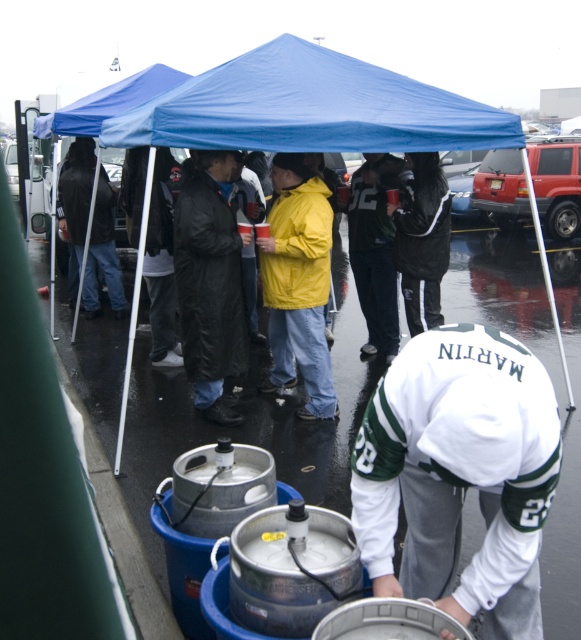
Question: Observing the image, what is the correct spatial positioning of matte black jacket at center in reference to dark blue jacket at center?

Choices:
 (A) right
 (B) left

Answer: (A)

Question: Based on their relative distances, which object is farther from the yellow matte jacket at center?

Choices:
 (A) blue fabric canopy at upper center
 (B) white jersey at lower center

Answer: (B)

Question: Considering the relative positions of black leather coat at center and dark blue jacket at center in the image provided, where is black leather coat at center located with respect to dark blue jacket at center?

Choices:
 (A) below
 (B) above

Answer: (A)

Question: Which object is the farthest from the white jersey at lower center?

Choices:
 (A) matte black jacket at center
 (B) blue fabric canopy at upper center

Answer: (A)

Question: Which point is farther to the camera?

Choices:
 (A) (88, 259)
 (B) (393, 518)
 (C) (187, 172)

Answer: (A)

Question: Can you confirm if yellow matte jacket at center is bigger than black leather jacket at center?

Choices:
 (A) yes
 (B) no

Answer: (B)